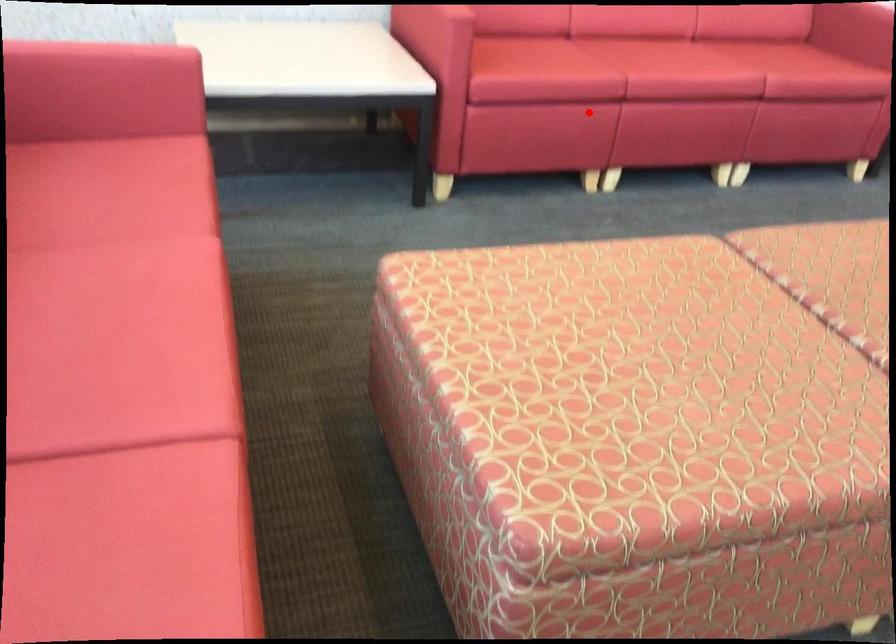
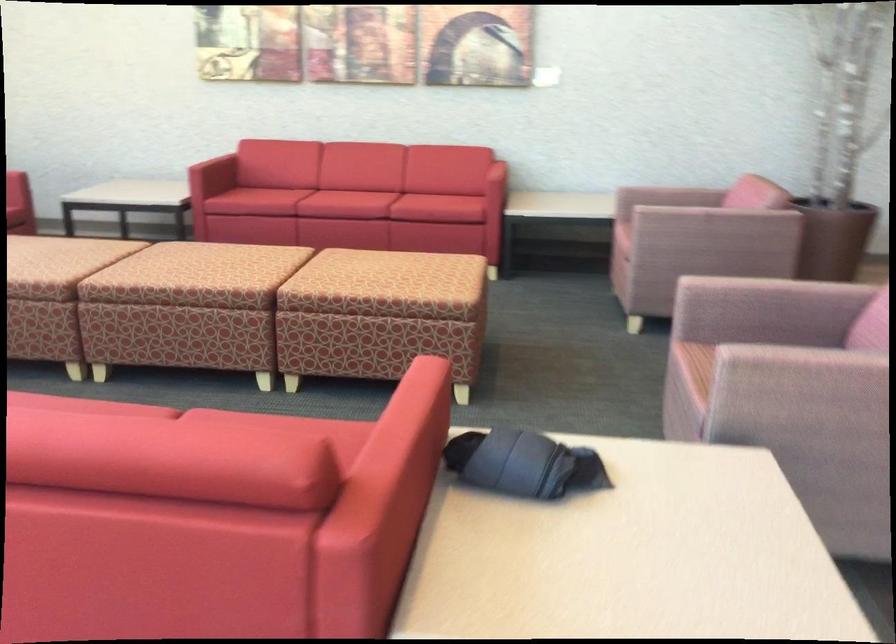
Find the pixel in the second image that matches the highlighted location in the first image.

(265, 200)